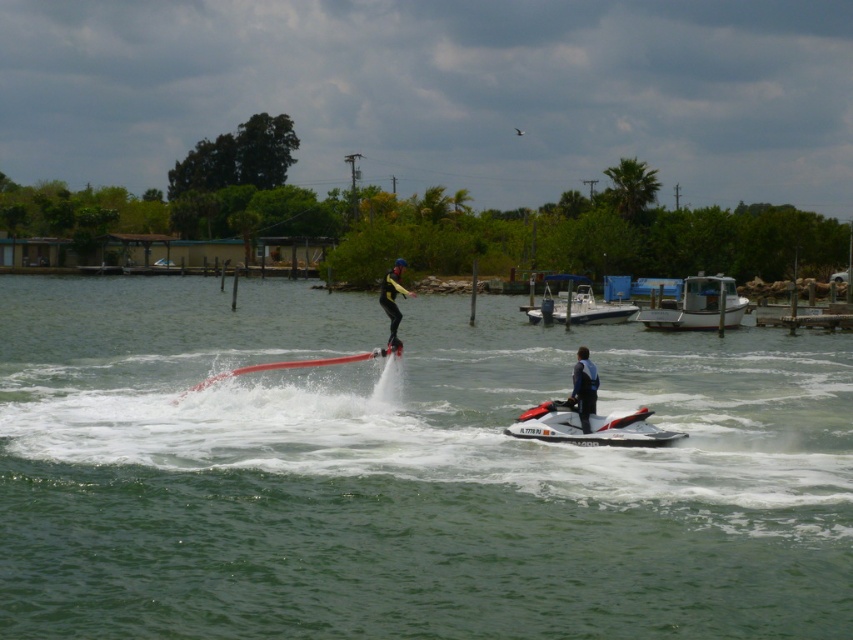
Question: Which is farther from the yellow matte wetsuit at center?

Choices:
 (A) white matte boat at right
 (B) white plastic boat at right

Answer: (A)

Question: Which point is farther to the camera?

Choices:
 (A) white matte jet ski at center
 (B) clear water at center
 (C) yellow matte wetsuit at center

Answer: (C)

Question: Is clear water at center smaller than yellow matte wetsuit at center?

Choices:
 (A) no
 (B) yes

Answer: (A)

Question: Among these points, which one is farthest from the camera?

Choices:
 (A) (395, 291)
 (B) (648, 428)
 (C) (512, 369)

Answer: (C)

Question: Can you confirm if white matte boat at right is bigger than dark blue wetsuit at center?

Choices:
 (A) yes
 (B) no

Answer: (A)

Question: Does clear water at center have a lesser width compared to dark blue wetsuit at center?

Choices:
 (A) yes
 (B) no

Answer: (B)